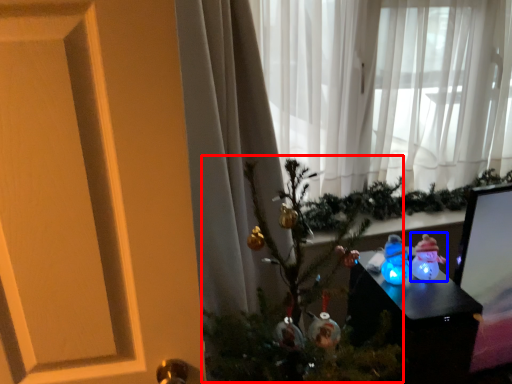
Question: Which object is further to the camera taking this photo, christmas tree (highlighted by a red box) or toy (highlighted by a blue box)?

Choices:
 (A) christmas tree
 (B) toy

Answer: (B)